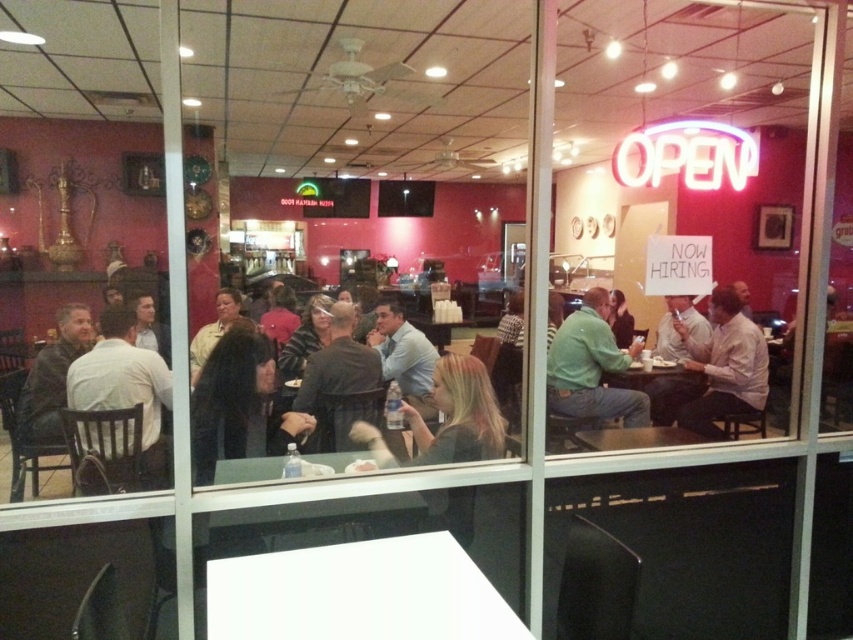
You are standing outside the restaurant looking through the window. There is a light brown leather jacket at left. Can you see the jacket from your current position?

Yes, the light brown leather jacket at left is visible from outside the restaurant since it is positioned at point [125,387] within the frame, which is within the viewable area through the window.

You are a customer waiting outside the restaurant. You see the green matte shirt at center and the leather jacket at left through the window. Which one is closer to the window?

The leather jacket at left is closer to the window because it is positioned to the left of the green matte shirt at center, which is further to the right.